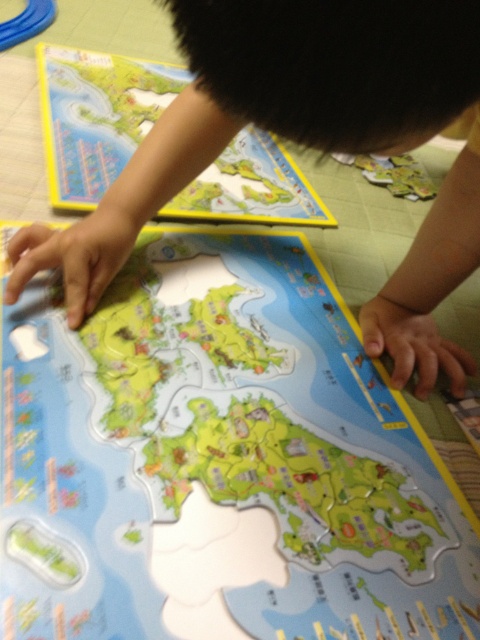
Question: Which of the following is the farthest from the observer?

Choices:
 (A) (271, 104)
 (B) (168, 211)
 (C) (289, 268)

Answer: (B)

Question: Does light blue plastic map at center appear on the left side of smooth skin at center?

Choices:
 (A) no
 (B) yes

Answer: (B)

Question: Which point appears farthest from the camera in this image?

Choices:
 (A) (36, 612)
 (B) (416, 348)

Answer: (B)

Question: Does smooth skin at center lie behind yellow paper map at upper left?

Choices:
 (A) no
 (B) yes

Answer: (A)

Question: Estimate the real-world distances between objects in this image. Which object is farther from the yellow paper map at upper left?

Choices:
 (A) smooth skin at center
 (B) light blue plastic map at center

Answer: (A)

Question: Can you confirm if light blue plastic map at center is positioned above smooth skin at center?

Choices:
 (A) no
 (B) yes

Answer: (A)